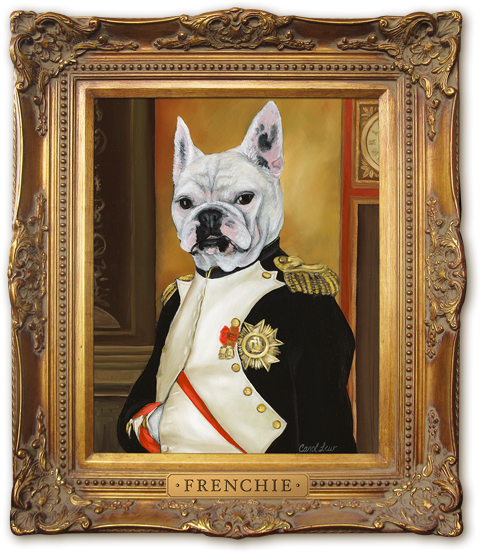
Locate an element on the screen. This screenshot has width=481, height=553. frame is located at coordinates (58, 513).